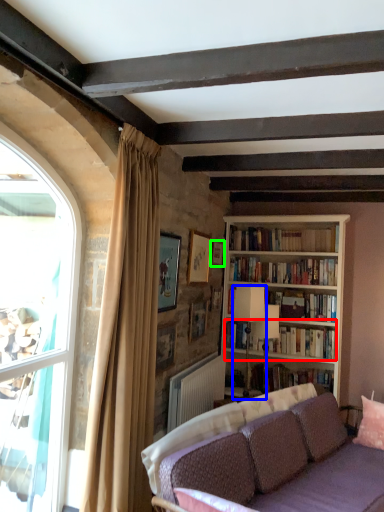
Question: Which object is positioned closest to book (highlighted by a red box)? Select from lamp (highlighted by a blue box) and picture frame (highlighted by a green box).

Choices:
 (A) lamp
 (B) picture frame

Answer: (A)